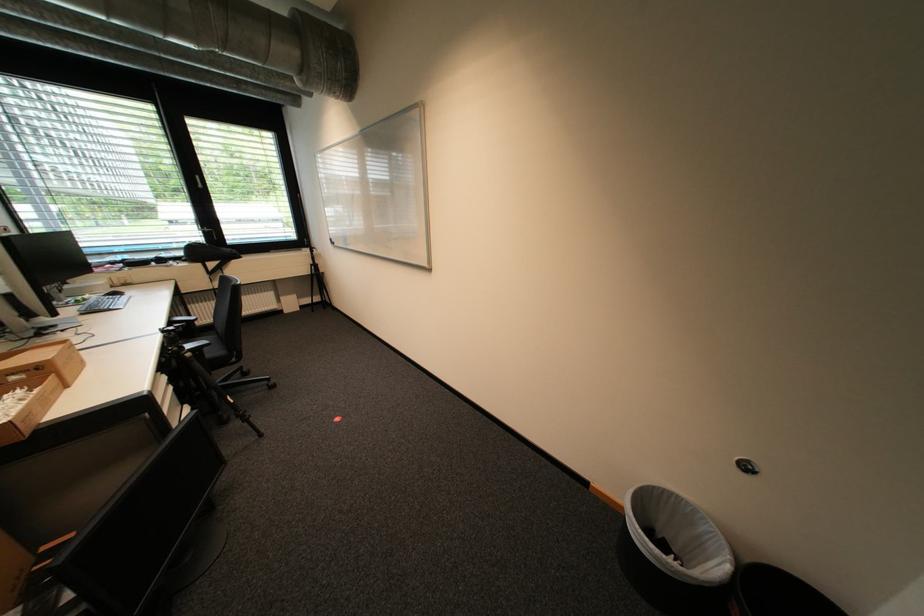
Where is `black chair armrest`? black chair armrest is located at coordinates (184, 323).